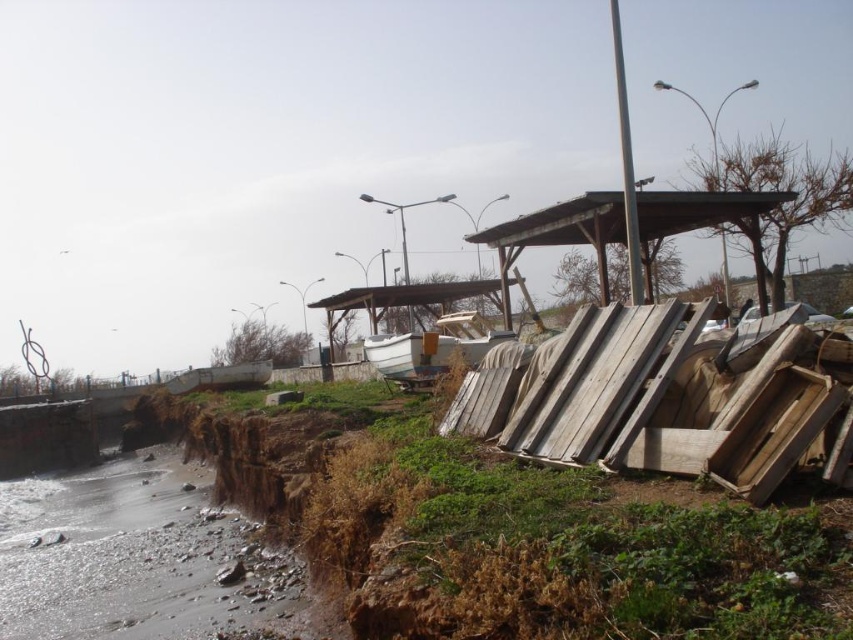
Question: Which point is closer to the camera?

Choices:
 (A) (553, 221)
 (B) (379, 346)

Answer: (A)

Question: Is wooden shelter at center thinner than white matte boat at center?

Choices:
 (A) no
 (B) yes

Answer: (A)

Question: Which object appears farthest from the camera in this image?

Choices:
 (A) wooden shelter at center
 (B) white matte boat at center

Answer: (B)

Question: Is wooden shelter at center further to camera compared to white matte boat at center?

Choices:
 (A) no
 (B) yes

Answer: (A)

Question: Which of the following is the farthest from the observer?

Choices:
 (A) white matte boat at center
 (B) wooden shelter at center

Answer: (A)

Question: Can you confirm if wooden shelter at center is thinner than white matte boat at center?

Choices:
 (A) no
 (B) yes

Answer: (A)